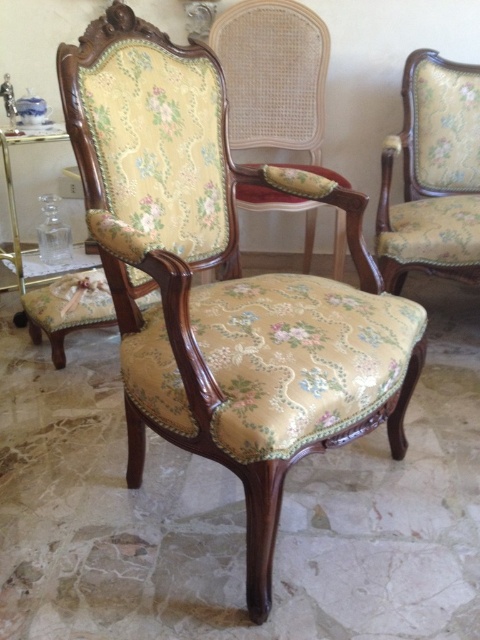
You are an interior designer planning to move a large potted plant into the space. The potted plant needs to be placed in front of the floral fabric armchair at center. However, there is a floral fabric stool at center in the way. Can you move the stool to make space without moving the armchair?

The floral fabric stool at center is positioned under the floral fabric armchair at center. To make space for the potted plant, you can move the stool to the side since it is beneath the armchair and not fixed in place.

You are arranging a living room and want to place the floral fabric stool at center and the matte glass lampshade at upper center. Since you need to ensure they fit within a 1.2 meter wide space, can both items fit side by side?

The floral fabric stool at center is wider than the matte glass lampshade at upper center. To determine if both can fit, you need to know the combined width of both items. However, the provided information only states that the stool is wider than the lampshade, but does not specify their exact measurements. Without knowing the exact widths, it is impossible to confirm if they will fit within the 1.2 meter space.